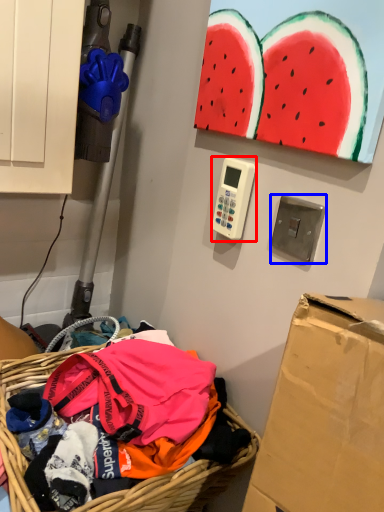
Question: Which of the following is the closest to the observer, scale (highlighted by a red box) or light switch (highlighted by a blue box)?

Choices:
 (A) scale
 (B) light switch

Answer: (B)